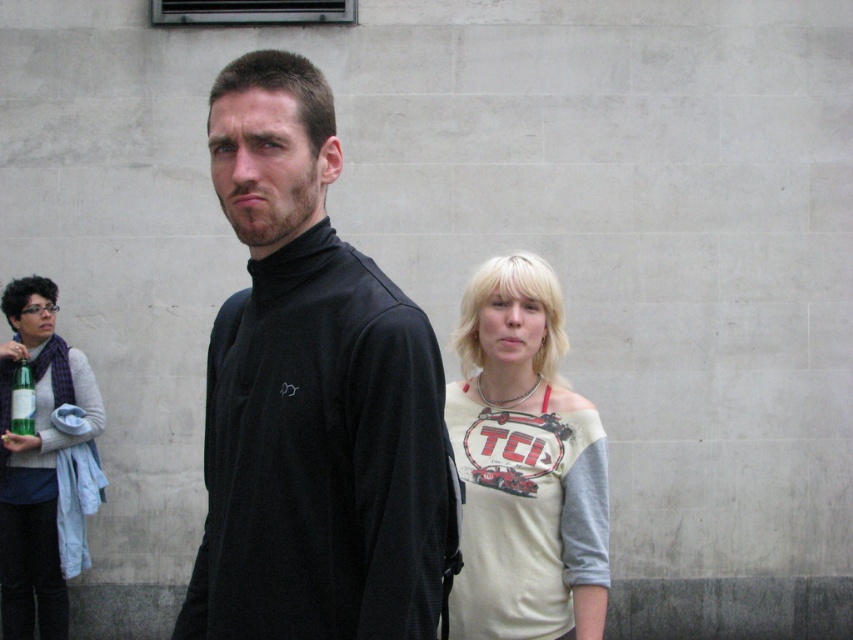
Question: Does matte gray sweater at left have a larger size compared to green glass bottle at left?

Choices:
 (A) no
 (B) yes

Answer: (B)

Question: Can you confirm if black matte turtleneck at center is wider than white matte shirt at center?

Choices:
 (A) yes
 (B) no

Answer: (A)

Question: Is black matte turtleneck at center closer to camera compared to white matte shirt at center?

Choices:
 (A) no
 (B) yes

Answer: (B)

Question: Among these points, which one is nearest to the camera?

Choices:
 (A) (44, 392)
 (B) (303, 180)
 (C) (466, 532)

Answer: (B)

Question: Which of the following is the closest to the observer?

Choices:
 (A) (56, 397)
 (B) (529, 508)
 (C) (335, 611)
 (D) (28, 365)

Answer: (C)

Question: Among these objects, which one is farthest from the camera?

Choices:
 (A) black matte turtleneck at center
 (B) matte gray sweater at left
 (C) white matte shirt at center
 (D) green glass bottle at left

Answer: (D)